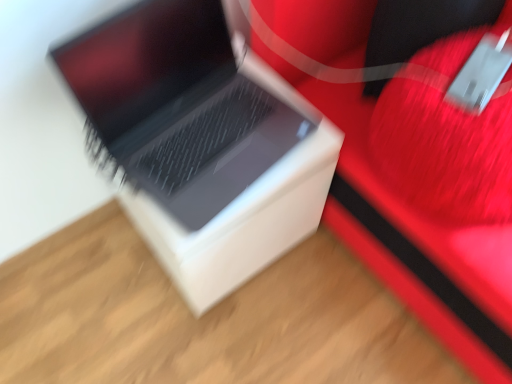
Question: Is white matte cardboard box at center wider or thinner than rubberized red suitcase at center?

Choices:
 (A) wide
 (B) thin

Answer: (B)

Question: From the image's perspective, is white matte cardboard box at center positioned above or below rubberized red suitcase at center?

Choices:
 (A) above
 (B) below

Answer: (B)

Question: Estimate the real-world distances between objects in this image. Which object is closer to the rubberized red suitcase at center?

Choices:
 (A) white matte cardboard box at center
 (B) sleek silver laptop at center

Answer: (A)

Question: Which object is the closest to the white matte cardboard box at center?

Choices:
 (A) rubberized red suitcase at center
 (B) sleek silver laptop at center

Answer: (B)